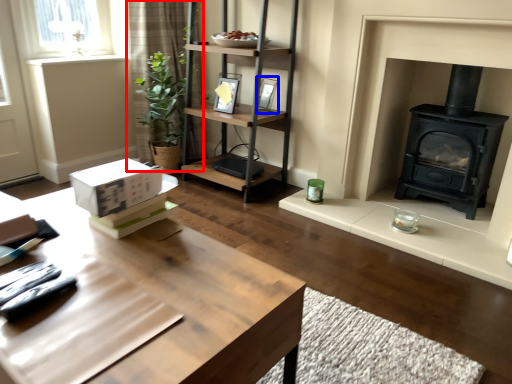
Question: Which of the following is the farthest to the observer, curtain (highlighted by a red box) or picture frame (highlighted by a blue box)?

Choices:
 (A) curtain
 (B) picture frame

Answer: (A)